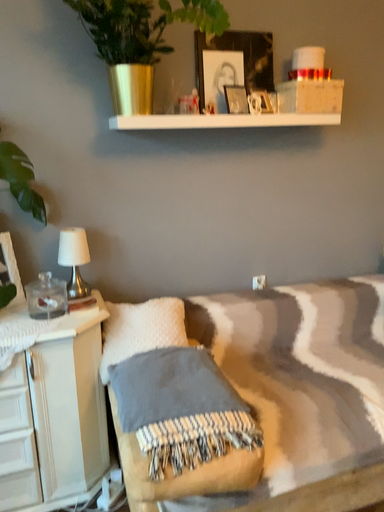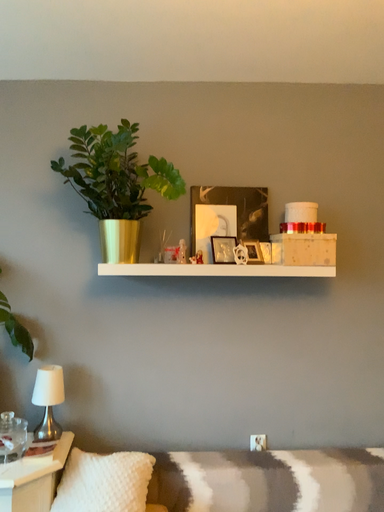
Question: Which way did the camera rotate in the video?

Choices:
 (A) rotated left
 (B) rotated right

Answer: (A)